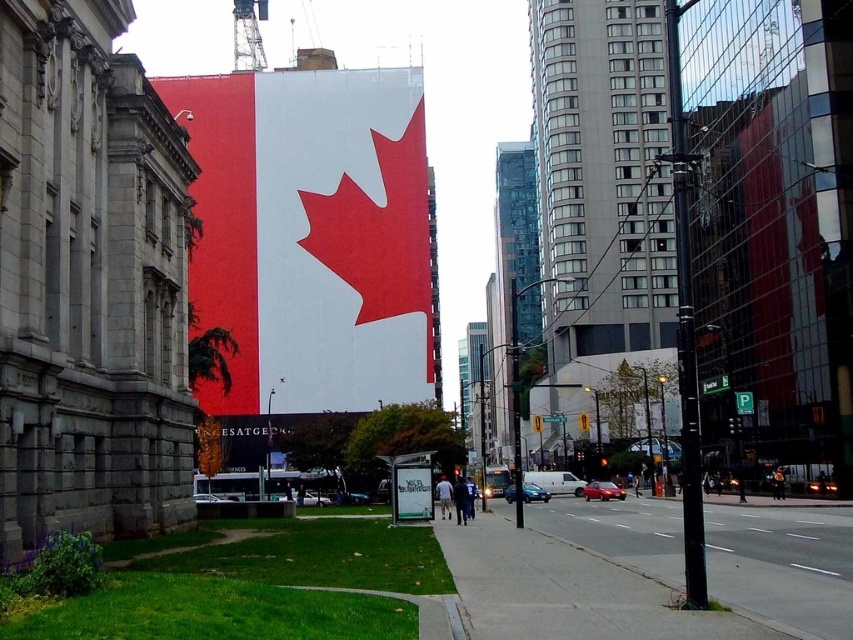
Question: Can you confirm if matte red and white flag at center is wider than gray asphalt pavement at lower right?

Choices:
 (A) yes
 (B) no

Answer: (A)

Question: Which object is closer to the camera taking this photo?

Choices:
 (A) gray asphalt pavement at lower right
 (B) white matte sign at center

Answer: (A)

Question: Can you confirm if matte red and white flag at center is smaller than white matte sign at center?

Choices:
 (A) yes
 (B) no

Answer: (B)

Question: Which object appears closest to the camera in this image?

Choices:
 (A) gray asphalt pavement at lower right
 (B) matte red and white flag at center

Answer: (A)

Question: Does gray asphalt pavement at lower right appear under white matte sign at center?

Choices:
 (A) yes
 (B) no

Answer: (A)

Question: Which object is positioned farthest from the gray asphalt pavement at lower right?

Choices:
 (A) white matte sign at center
 (B) matte red and white flag at center

Answer: (B)